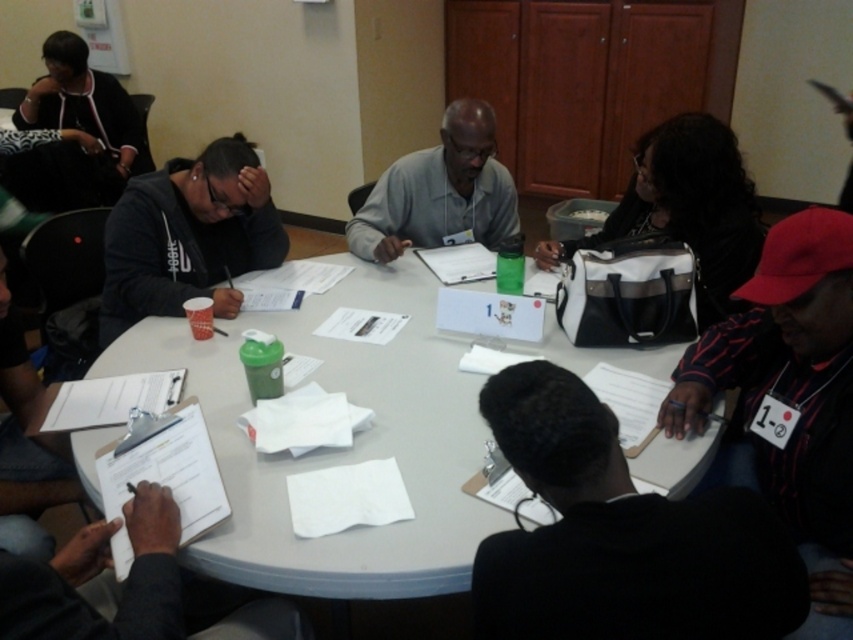
Does white paper at center appear over white fabric bag at upper right?

No.

Does white paper at center come in front of white fabric bag at upper right?

Yes, white paper at center is in front of white fabric bag at upper right.

Who is more distant from viewer, (459, 419) or (712, 301)?

The point (712, 301) is more distant.

The height and width of the screenshot is (640, 853). I want to click on white paper at center, so click(339, 449).

Between point (422, 173) and point (56, 54), which one is positioned in front?

Point (422, 173) is more forward.

Is gray matte shirt at center to the left of matte black jacket at upper left from the viewer's perspective?

In fact, gray matte shirt at center is to the right of matte black jacket at upper left.

What do you see at coordinates (439, 193) in the screenshot? This screenshot has height=640, width=853. I see `gray matte shirt at center` at bounding box center [439, 193].

The height and width of the screenshot is (640, 853). I want to click on gray matte shirt at center, so click(439, 193).

Between point (468, 518) and point (62, 104), which one is positioned in front?

Point (468, 518) is in front.

Find the location of a particular element. This screenshot has height=640, width=853. white paper at center is located at coordinates (339, 449).